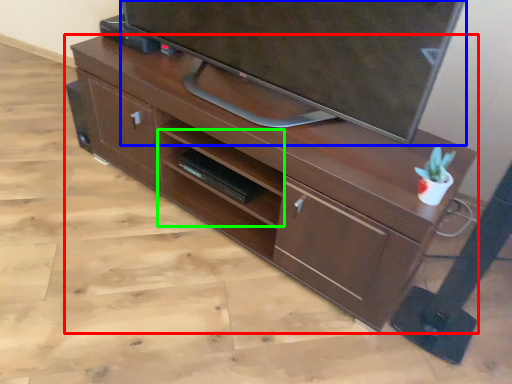
Question: Considering the real-world distances, which object is farthest from desk (highlighted by a red box)? television (highlighted by a blue box) or shelf (highlighted by a green box)?

Choices:
 (A) television
 (B) shelf

Answer: (A)